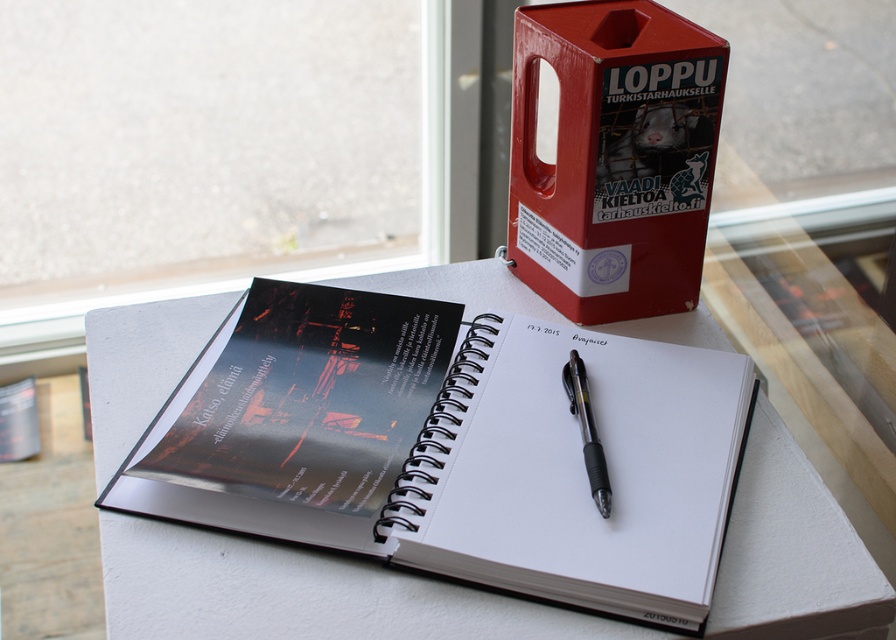
Question: Is white paper notebook at center to the right of transparent glass window at upper center from the viewer's perspective?

Choices:
 (A) yes
 (B) no

Answer: (A)

Question: Which object is the closest to the black plastic pen at center?

Choices:
 (A) white paper notebook at center
 (B) transparent glass window at upper center

Answer: (A)

Question: Is transparent glass window at upper center further to camera compared to black plastic pen at center?

Choices:
 (A) no
 (B) yes

Answer: (B)

Question: Which is nearer to the white paper notebook at center?

Choices:
 (A) red plastic box at upper right
 (B) black plastic pen at center

Answer: (B)

Question: Where is transparent glass window at upper center located in relation to red plastic box at upper right in the image?

Choices:
 (A) above
 (B) below

Answer: (A)

Question: Among these points, which one is nearest to the camera?

Choices:
 (A) (687, 90)
 (B) (363, 189)
 (C) (588, 432)

Answer: (C)